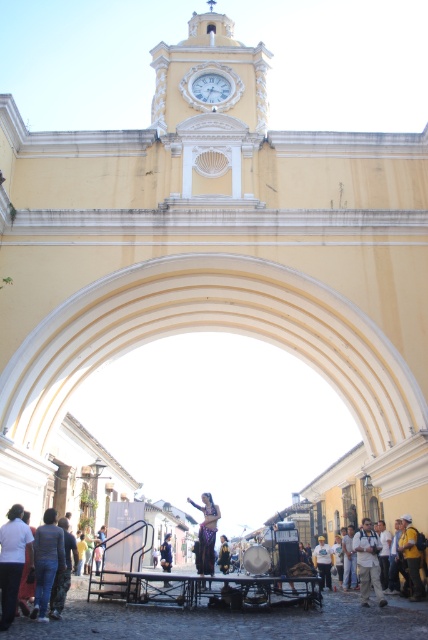
Question: Considering the real-world distances, which object is closest to the white glossy clock at upper center?

Choices:
 (A) yellow fabric at lower right
 (B) jeans at lower left
 (C) white cotton shirt at lower left

Answer: (B)

Question: Estimate the real-world distances between objects in this image. Which object is farther from the white glossy clock at upper center?

Choices:
 (A) yellow fabric at lower right
 (B) shiny purple fabric at center

Answer: (A)

Question: Is white cotton shirt at lower left thinner than light brown leather jacket at center?

Choices:
 (A) no
 (B) yes

Answer: (B)

Question: Is shiny purple fabric at center below yellow fabric at lower right?

Choices:
 (A) yes
 (B) no

Answer: (A)

Question: Which of the following is the farthest from the observer?

Choices:
 (A) (166, 580)
 (B) (55, 515)
 (C) (225, 568)

Answer: (C)

Question: Is yellow fabric at lower right further to the viewer compared to white cotton shirt at center?

Choices:
 (A) no
 (B) yes

Answer: (A)